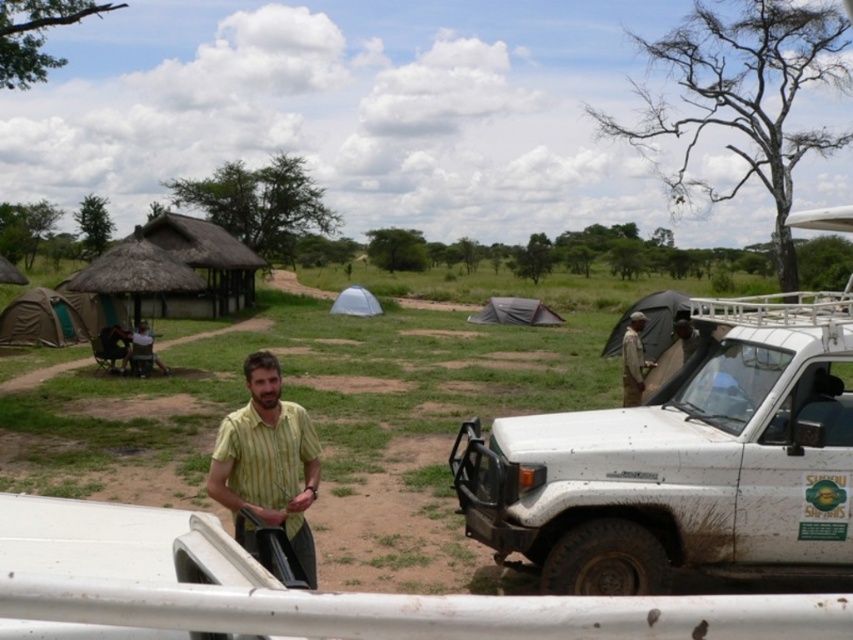
You are a hiker who wants to take a photo of the white matte pickup truck at center and the yellow striped shirt at center from a distance. Which object will appear smaller in the photo?

The white matte pickup truck at center will appear smaller in the photo because it is shorter than the yellow striped shirt at center.

You are a hiker who needs to reach the yellow striped shirt at center from the white matte pickup truck at center. Can you walk directly between them without any obstacles?

The distance between the white matte pickup truck at center and the yellow striped shirt at center is 6.82 feet, so yes, you can walk directly between them without any obstacles as there is enough space.

From the picture: You are a hiker trying to locate your belongings in the camping scene. You remember leaving your yellow striped shirt at center and your light brown leather jacket at center near the vehicle. Which item is closer to the open door of the white vehicle?

The yellow striped shirt at center is closer to the open door of the white vehicle because it is positioned to the left of the light brown leather jacket at center, and since the vehicle is in the foreground with a person near its open door, the left side would be nearer to the door.